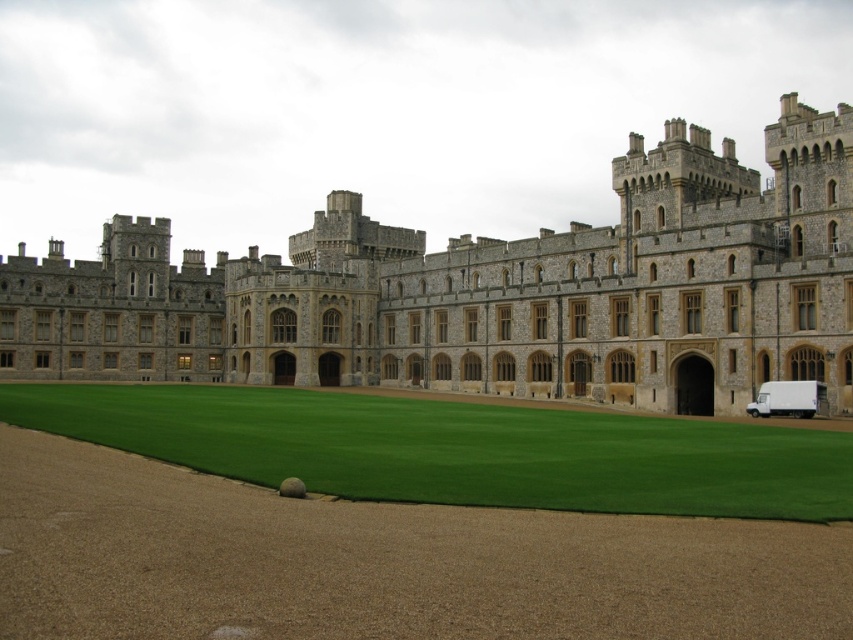
Question: Which point is farther to the camera?

Choices:
 (A) (759, 410)
 (B) (279, 404)
 (C) (703, 284)

Answer: (B)

Question: Observing the image, what is the correct spatial positioning of stone castle at center in reference to white matte van at lower right?

Choices:
 (A) below
 (B) above

Answer: (B)

Question: Considering the real-world distances, which object is closest to the green artificial turf at center?

Choices:
 (A) stone castle at center
 (B) white matte van at lower right

Answer: (A)

Question: Estimate the real-world distances between objects in this image. Which object is closer to the green artificial turf at center?

Choices:
 (A) white matte van at lower right
 (B) stone castle at center

Answer: (B)

Question: Is stone castle at center closer to the viewer compared to white matte van at lower right?

Choices:
 (A) yes
 (B) no

Answer: (A)

Question: Is stone castle at center to the left of green artificial turf at center from the viewer's perspective?

Choices:
 (A) yes
 (B) no

Answer: (A)